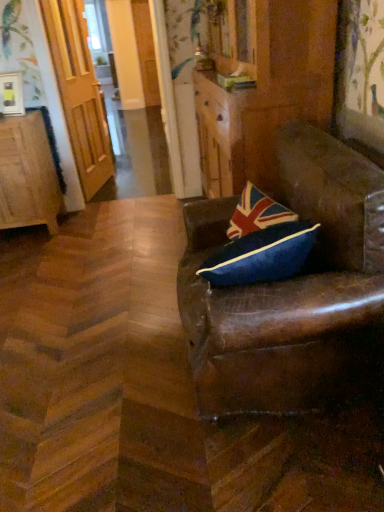
Where is `brown leather chair at right`? This screenshot has height=512, width=384. brown leather chair at right is located at coordinates (293, 292).

Measure the distance between point [337,292] and camera.

Point [337,292] and camera are 4.20 feet apart.

Where is `brown leather chair at right`? brown leather chair at right is located at coordinates (293, 292).

This screenshot has width=384, height=512. Find the location of `chair that appears in front of the brown leather dresser at center`. chair that appears in front of the brown leather dresser at center is located at coordinates (293, 292).

Is brown leather dresser at center looking in the opposite direction of brown leather chair at right?

No, brown leather dresser at center's orientation is not away from brown leather chair at right.

Considering the positions of objects brown leather dresser at center and brown leather chair at right in the image provided, who is more to the left, brown leather dresser at center or brown leather chair at right?

Positioned to the left is brown leather dresser at center.

Locate an element on the screen. chair on the right side of brown leather dresser at center is located at coordinates (293, 292).

From a real-world perspective, is brown leather chair at right located beneath brown leather dresser at center?

Yes, from a real-world perspective, brown leather chair at right is beneath brown leather dresser at center.

Based on the photo, could you tell me if brown leather chair at right is facing brown leather dresser at center?

No, brown leather chair at right is not aimed at brown leather dresser at center.

Is wooden cabinet at left smaller than brown leather dresser at center?

Yes.

Considering the positions of objects wooden cabinet at left and brown leather dresser at center in the image provided, who is in front, wooden cabinet at left or brown leather dresser at center?

brown leather dresser at center is closer to the camera.

Is wooden cabinet at left oriented away from brown leather dresser at center?

That's not correct — wooden cabinet at left is not looking away from brown leather dresser at center.

Locate an element on the screen. This screenshot has height=512, width=384. dresser that appears above the wooden cabinet at left (from a real-world perspective) is located at coordinates (262, 87).

Considering the sizes of objects brown leather dresser at center and wooden door at left in the image provided, who is thinner, brown leather dresser at center or wooden door at left?

wooden door at left is thinner.

You are a GUI agent. You are given a task and a screenshot of the screen. Output one action in this format:
    pyautogui.click(x=<x>, y=<y>)
    Task: Click on the door above the brown leather dresser at center (from the image's perspective)
    This screenshot has height=512, width=384.
    Given the screenshot: What is the action you would take?
    pyautogui.click(x=79, y=93)

Consider the image. From a real-world perspective, between brown leather dresser at center and wooden door at left, who is vertically higher?

From a 3D spatial view, wooden door at left is above.

Are wooden cabinet at left and brown leather chair at right beside each other?

wooden cabinet at left is not next to brown leather chair at right, and they're not touching.

Which point is more forward, (x=16, y=213) or (x=357, y=383)?

The point (x=357, y=383) is closer to the camera.

From the image's perspective, does wooden cabinet at left appear lower than brown leather chair at right?

No, from the image's perspective, wooden cabinet at left is not beneath brown leather chair at right.

There is a wooden cabinet at left. Identify the location of chair above it (from a real-world perspective). (293, 292).

Does wooden cabinet at left appear on the right side of wooden door at left?

Incorrect, wooden cabinet at left is not on the right side of wooden door at left.

What's the angular difference between wooden cabinet at left and wooden door at left's facing directions?

wooden cabinet at left and wooden door at left are facing 76 degrees away from each other.

Is wooden cabinet at left not inside wooden door at left?

Yes, wooden cabinet at left is not within wooden door at left.

Which object is more forward, wooden door at left or brown leather chair at right?

brown leather chair at right is closer to the camera.

Is wooden door at left at the left side of brown leather chair at right?

Correct, you'll find wooden door at left to the left of brown leather chair at right.

From the image's perspective, relative to brown leather chair at right, is wooden door at left above or below?

wooden door at left is situated higher than brown leather chair at right in the image.

Find the location of a particular element. This screenshot has width=384, height=512. dresser above the brown leather chair at right (from the image's perspective) is located at coordinates (262, 87).

The width and height of the screenshot is (384, 512). What are the coordinates of `dresser on the left side of brown leather chair at right` in the screenshot? It's located at (262, 87).

Estimate the real-world distances between objects in this image. Which object is further from brown leather dresser at center, wooden door at left or brown leather chair at right?

wooden door at left is positioned further to the anchor brown leather dresser at center.

Looking at this image, which object lies nearer to the anchor point wooden door at left, brown leather dresser at center or wooden cabinet at left?

wooden cabinet at left.

When comparing their distances from wooden door at left, does brown leather chair at right or brown leather dresser at center seem further?

brown leather chair at right is positioned further to the anchor wooden door at left.

Looking at the image, which one is located further to wooden cabinet at left, brown leather dresser at center or brown leather chair at right?

The object further to wooden cabinet at left is brown leather chair at right.

Considering their positions, is brown leather chair at right positioned further to wooden cabinet at left than wooden door at left?

brown leather chair at right lies further to wooden cabinet at left than the other object.

Considering their positions, is wooden cabinet at left positioned further to brown leather dresser at center than wooden door at left?

The object further to brown leather dresser at center is wooden door at left.

Considering their positions, is wooden door at left positioned closer to brown leather chair at right than brown leather dresser at center?

brown leather dresser at center is closer to brown leather chair at right.

Based on their spatial positions, is wooden door at left or wooden cabinet at left closer to brown leather dresser at center?

Based on the image, wooden cabinet at left appears to be nearer to brown leather dresser at center.

Find the location of a particular element. This screenshot has width=384, height=512. dresser situated between wooden cabinet at left and brown leather chair at right from left to right is located at coordinates [262, 87].

You are a GUI agent. You are given a task and a screenshot of the screen. Output one action in this format:
    pyautogui.click(x=<x>, y=<y>)
    Task: Click on the cabinetry positioned between brown leather chair at right and wooden door at left from near to far
    This screenshot has height=512, width=384.
    Given the screenshot: What is the action you would take?
    pyautogui.click(x=28, y=174)

Identify the location of door between wooden cabinet at left and brown leather dresser at center from left to right. pyautogui.click(x=79, y=93).

You are a GUI agent. You are given a task and a screenshot of the screen. Output one action in this format:
    pyautogui.click(x=<x>, y=<y>)
    Task: Click on the dresser between brown leather chair at right and wooden door at left from front to back
    This screenshot has width=384, height=512.
    Given the screenshot: What is the action you would take?
    pyautogui.click(x=262, y=87)